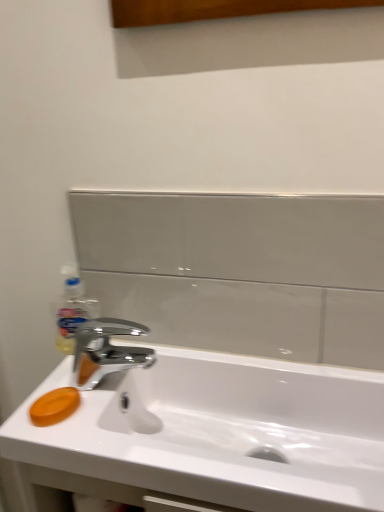
I want to click on space that is in front of chrome metallic faucet at center, so click(113, 441).